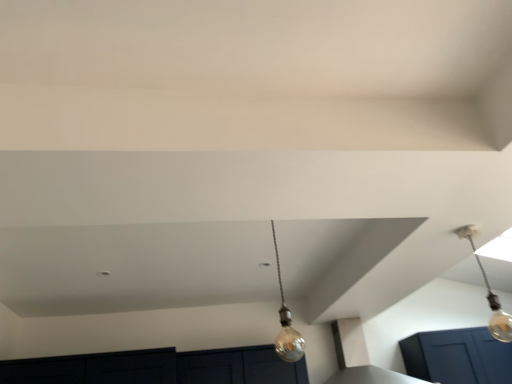
Identify the location of translucent glass bulb at upper right. (489, 293).

This screenshot has width=512, height=384. Describe the element at coordinates (489, 293) in the screenshot. I see `translucent glass bulb at upper right` at that location.

The width and height of the screenshot is (512, 384). I want to click on translucent glass bulb at upper right, so click(489, 293).